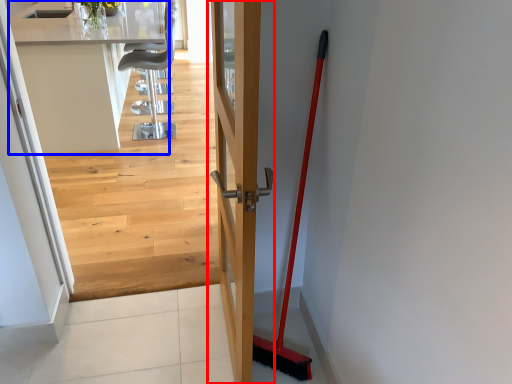
Question: Which object is closer to the camera taking this photo, door (highlighted by a red box) or counter top (highlighted by a blue box)?

Choices:
 (A) door
 (B) counter top

Answer: (A)